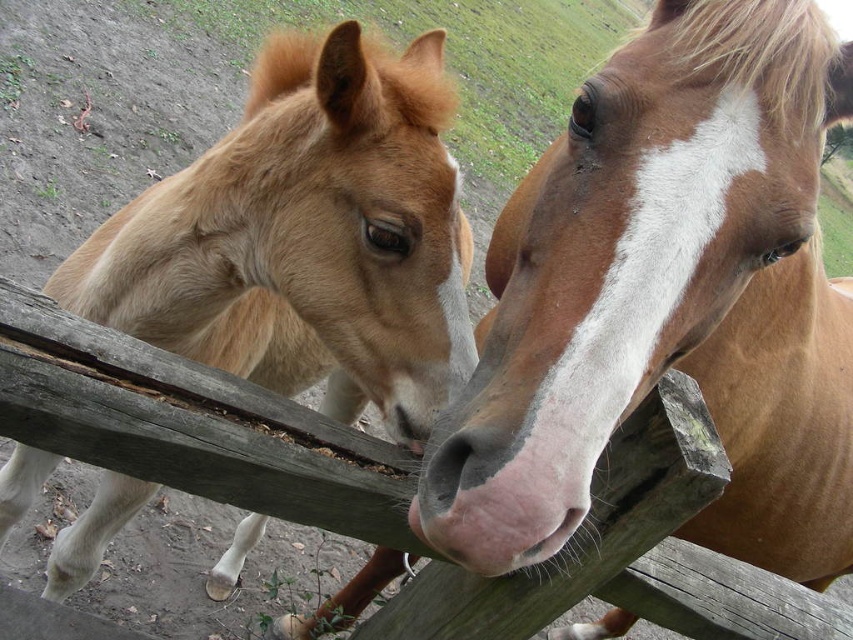
You are standing at the origin point of the coordinate system. Where is the brown glossy horse at center located?

The brown glossy horse at center is located at point (x=666, y=298).

You are a farmer who needs to separate the brown glossy horse at center and the light brown fur at left with a fence. The fence you have is 24 inches long. Will it be sufficient to place between them?

The distance between the brown glossy horse at center and the light brown fur at left is 24.65 inches. The fence is only 24 inches long, so it will not be sufficient to place between them because it is shorter than the required distance.

In the scene shown: You are standing in front of the wooden fence and see the brown glossy horse at center and the light brown fur at left. Which horse is nearer to you?

The brown glossy horse at center is closer to the viewer than the light brown fur at left, so the brown glossy horse at center is nearer to you.